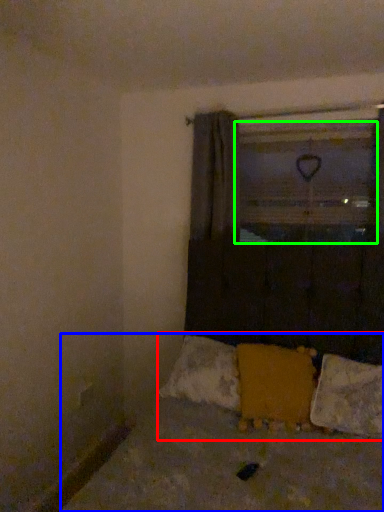
Question: Based on their relative distances, which object is farther from bedding (highlighted by a red box)? Choose from bed (highlighted by a blue box) and window screen (highlighted by a green box).

Choices:
 (A) bed
 (B) window screen

Answer: (B)